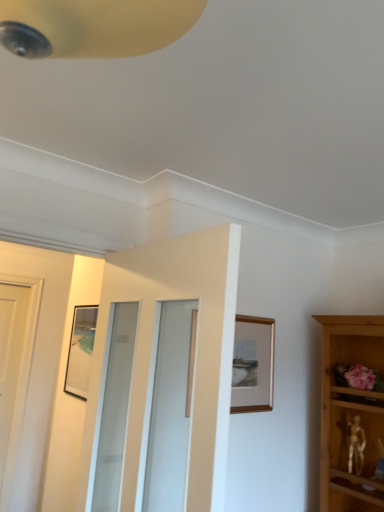
What do you see at coordinates (155, 358) in the screenshot?
I see `white glossy door at center` at bounding box center [155, 358].

The image size is (384, 512). I want to click on white glossy door at center, so click(155, 358).

Where is `wooden picture frame at upper center`? wooden picture frame at upper center is located at coordinates (254, 365).

What do you see at coordinates (254, 365) in the screenshot? Image resolution: width=384 pixels, height=512 pixels. I see `wooden picture frame at upper center` at bounding box center [254, 365].

Measure the distance between point (242,364) and camera.

1.97 meters.

This screenshot has width=384, height=512. In order to click on white glossy door at center in this screenshot , I will do (155, 358).

In the image, is white glossy door at center on the left side or the right side of wooden picture frame at upper center?

white glossy door at center is positioned on wooden picture frame at upper center's left side.

Who is more distant, white glossy door at center or wooden picture frame at upper center?

Positioned behind is wooden picture frame at upper center.

Considering the points (215, 467) and (244, 395), which point is in front, point (215, 467) or point (244, 395)?

The point (215, 467) is closer to the camera.

From the image's perspective, which one is positioned lower, white glossy door at center or wooden picture frame at upper center?

wooden picture frame at upper center appears lower in the image.

From a real-world perspective, is white glossy door at center positioned under wooden picture frame at upper center based on gravity?

Yes, from a real-world perspective, white glossy door at center is under wooden picture frame at upper center.

Is white glossy door at center wider or thinner than wooden picture frame at upper center?

Clearly, white glossy door at center has more width compared to wooden picture frame at upper center.

Who is shorter, white glossy door at center or wooden picture frame at upper center?

Standing shorter between the two is wooden picture frame at upper center.

In the scene shown: Considering the relative sizes of white glossy door at center and wooden picture frame at upper center in the image provided, is white glossy door at center bigger than wooden picture frame at upper center?

Yes.

Could wooden picture frame at upper center be considered to be inside white glossy door at center?

That's incorrect, wooden picture frame at upper center is not inside white glossy door at center.

Is there a large distance between white glossy door at center and wooden picture frame at upper center?

No, white glossy door at center is not far from wooden picture frame at upper center.

Is white glossy door at center oriented towards wooden picture frame at upper center?

No, white glossy door at center is not aimed at wooden picture frame at upper center.

Identify the location of door below the wooden picture frame at upper center (from a real-world perspective). Image resolution: width=384 pixels, height=512 pixels. (155, 358).

Considering the relative positions of wooden picture frame at upper center and white glossy door at center in the image provided, is wooden picture frame at upper center to the left of white glossy door at center from the viewer's perspective?

Incorrect, wooden picture frame at upper center is not on the left side of white glossy door at center.

Is wooden picture frame at upper center in front of or behind white glossy door at center in the image?

wooden picture frame at upper center is positioned farther from the viewer than white glossy door at center.

Considering the points (239, 396) and (201, 504), which point is in front, point (239, 396) or point (201, 504)?

The point (201, 504) is more forward.

From the image's perspective, is wooden picture frame at upper center positioned above or below white glossy door at center?

Clearly, from the image's perspective, wooden picture frame at upper center is below white glossy door at center.

From a real-world perspective, who is located lower, wooden picture frame at upper center or white glossy door at center?

white glossy door at center.

Can you confirm if wooden picture frame at upper center is wider than white glossy door at center?

In fact, wooden picture frame at upper center might be narrower than white glossy door at center.

Considering the relative sizes of wooden picture frame at upper center and white glossy door at center in the image provided, is wooden picture frame at upper center shorter than white glossy door at center?

Indeed, wooden picture frame at upper center has a lesser height compared to white glossy door at center.

Who is smaller, wooden picture frame at upper center or white glossy door at center?

wooden picture frame at upper center.

Which is correct: wooden picture frame at upper center is inside white glossy door at center, or outside of it?

wooden picture frame at upper center is not enclosed by white glossy door at center.

Is wooden picture frame at upper center not near white glossy door at center?

wooden picture frame at upper center is near white glossy door at center, not far away.

Is wooden picture frame at upper center positioned with its back to white glossy door at center?

wooden picture frame at upper center does not have its back to white glossy door at center.

Where is `door lying above the wooden picture frame at upper center (from the image's perspective)`? door lying above the wooden picture frame at upper center (from the image's perspective) is located at coordinates (155, 358).

Identify the location of picture frame behind the white glossy door at center. This screenshot has width=384, height=512. (254, 365).

At what (x,y) coordinates should I click in order to perform the action: click on picture frame above the white glossy door at center (from a real-world perspective). Please return your answer as a coordinate pair (x, y). Image resolution: width=384 pixels, height=512 pixels. Looking at the image, I should click on (254, 365).